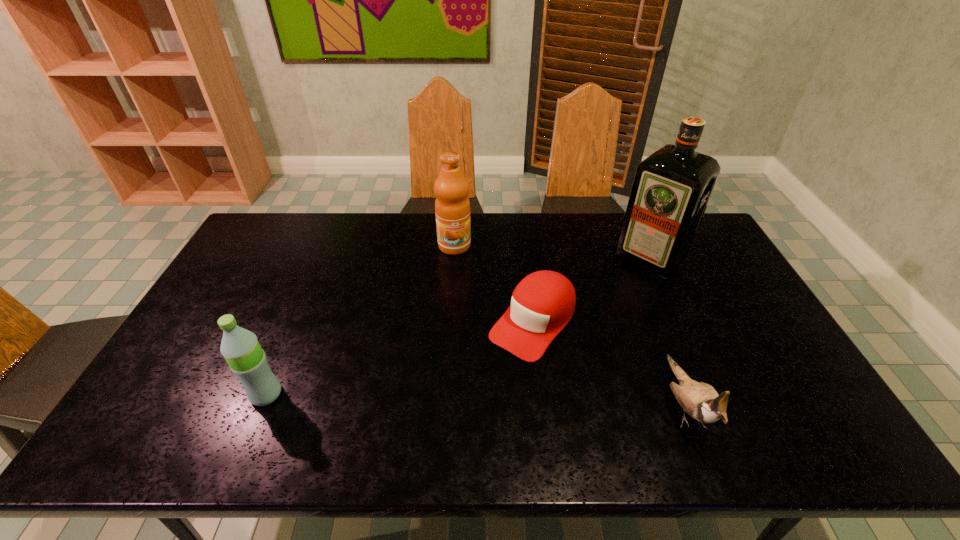
This screenshot has width=960, height=540. I want to click on free space that satisfies the following two spatial constraints: 1. on the back side of the third tallest object; 2. on the right side of the second tallest object, so click(x=327, y=246).

What are the coordinates of `free spot that satisfies the following two spatial constraints: 1. on the back side of the liquor; 2. on the right side of the third tallest object` in the screenshot? It's located at (323, 258).

Where is `free space that satisfies the following two spatial constraints: 1. on the front side of the fourth shortest object; 2. on the left side of the liquor`? The image size is (960, 540). free space that satisfies the following two spatial constraints: 1. on the front side of the fourth shortest object; 2. on the left side of the liquor is located at coordinates (454, 258).